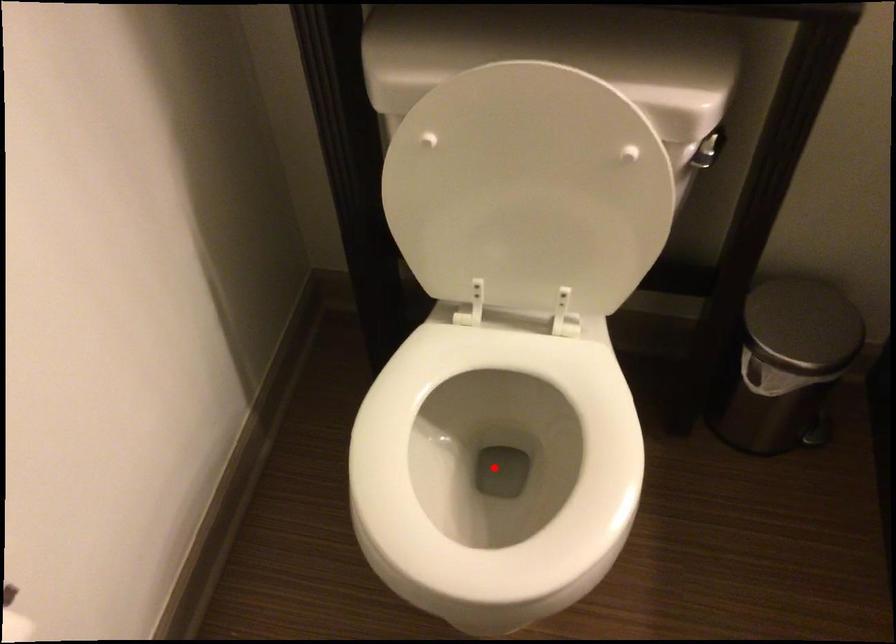
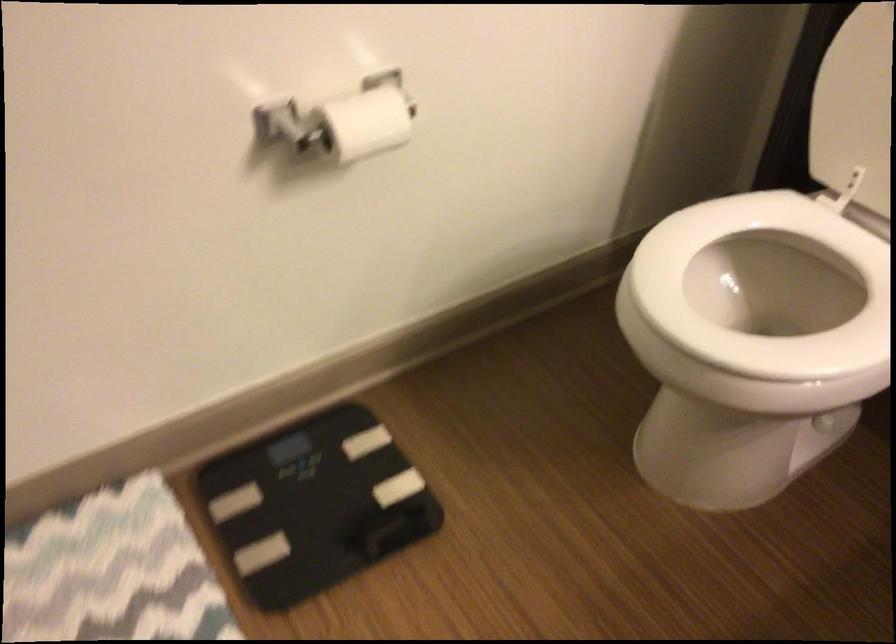
Question: I am providing you with two images of the same scene from different viewpoints. A red point is marked on the first image. At the location where the point appears in image 1, is it still visible in image 2?

Choices:
 (A) Yes
 (B) No

Answer: (B)